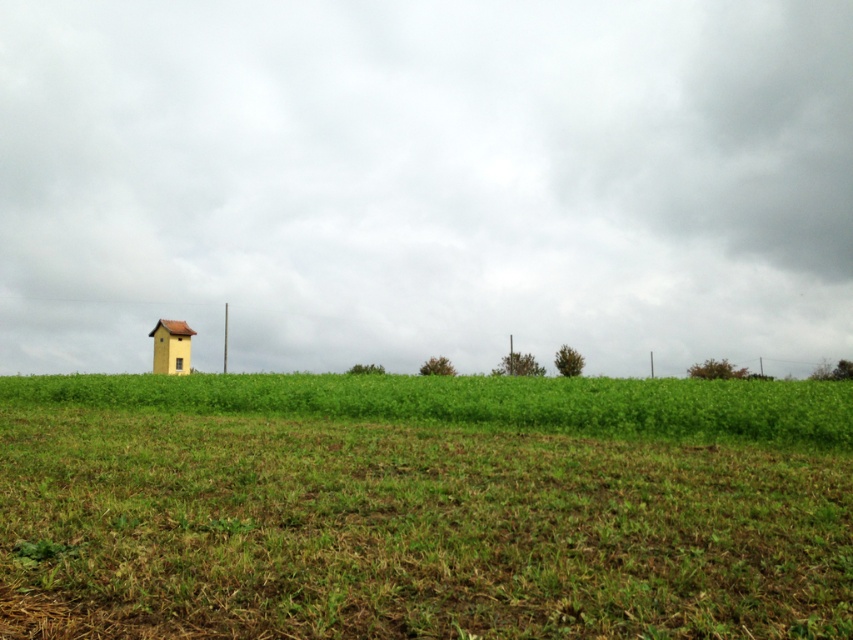
Can you confirm if green grassy field at center is taller than yellow matte hut at left?

No, green grassy field at center is not taller than yellow matte hut at left.

Between green grassy field at center and yellow matte hut at left, which one has more height?

yellow matte hut at left is taller.

Where is `green grassy field at center`? This screenshot has height=640, width=853. green grassy field at center is located at coordinates (422, 506).

Is matte yellow building at left to the right of yellow matte hut at left from the viewer's perspective?

Yes, matte yellow building at left is to the right of yellow matte hut at left.

Who is more distant from viewer, [74,157] or [155,337]?

Point [155,337]

Who is more distant from viewer, (819,99) or (183,369)?

Positioned behind is point (183,369).

Where is `matte yellow building at left`? The height and width of the screenshot is (640, 853). matte yellow building at left is located at coordinates (425, 182).

Who is more distant from viewer, (56,182) or (801,483)?

The point (56,182) is more distant.

I want to click on matte yellow building at left, so click(x=425, y=182).